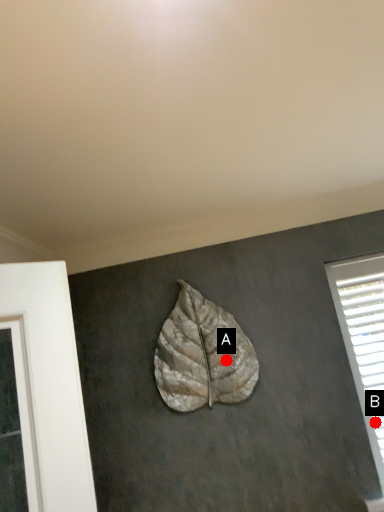
Question: Two points are circled on the image, labeled by A and B beside each circle. Which point is closer to the camera taking this photo?

Choices:
 (A) A is closer
 (B) B is closer

Answer: (B)